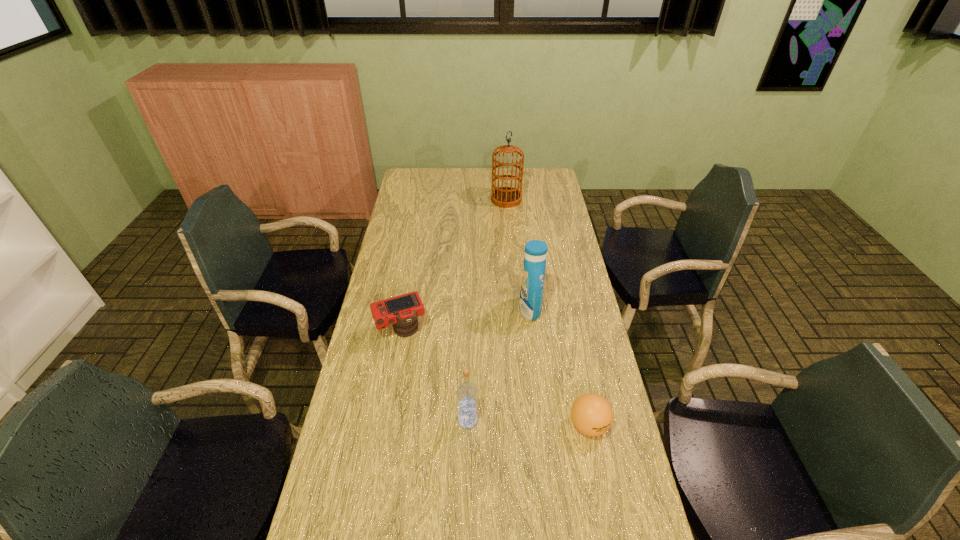
This screenshot has height=540, width=960. In the image, there is a desktop. Find the location of `free space at the far right corner`. free space at the far right corner is located at coordinates (539, 185).

Where is `free spot between the ping-pong ball and the camera`? The height and width of the screenshot is (540, 960). free spot between the ping-pong ball and the camera is located at coordinates (494, 377).

The height and width of the screenshot is (540, 960). I want to click on free spot between the leftmost object and the detergent, so click(x=466, y=320).

This screenshot has height=540, width=960. What are the coordinates of `vacant area that lies between the ping-pong ball and the camera` in the screenshot? It's located at (494, 377).

Find the location of a particular element. free space that is in between the fourth object from right to left and the rightmost object is located at coordinates (528, 423).

You are a GUI agent. You are given a task and a screenshot of the screen. Output one action in this format:
    pyautogui.click(x=<x>, y=<y>)
    Task: Click on the free space between the detergent and the rightmost object
    The height and width of the screenshot is (540, 960).
    Given the screenshot: What is the action you would take?
    pyautogui.click(x=559, y=368)

I want to click on free spot between the leftmost object and the rightmost object, so click(494, 377).

The height and width of the screenshot is (540, 960). I want to click on vacant space that's between the second object from left to right and the ping-pong ball, so click(528, 423).

Image resolution: width=960 pixels, height=540 pixels. Find the location of `free point between the tallest object and the camera`. free point between the tallest object and the camera is located at coordinates (453, 265).

Find the location of a particular element. The height and width of the screenshot is (540, 960). free space between the birdcage and the rightmost object is located at coordinates (547, 313).